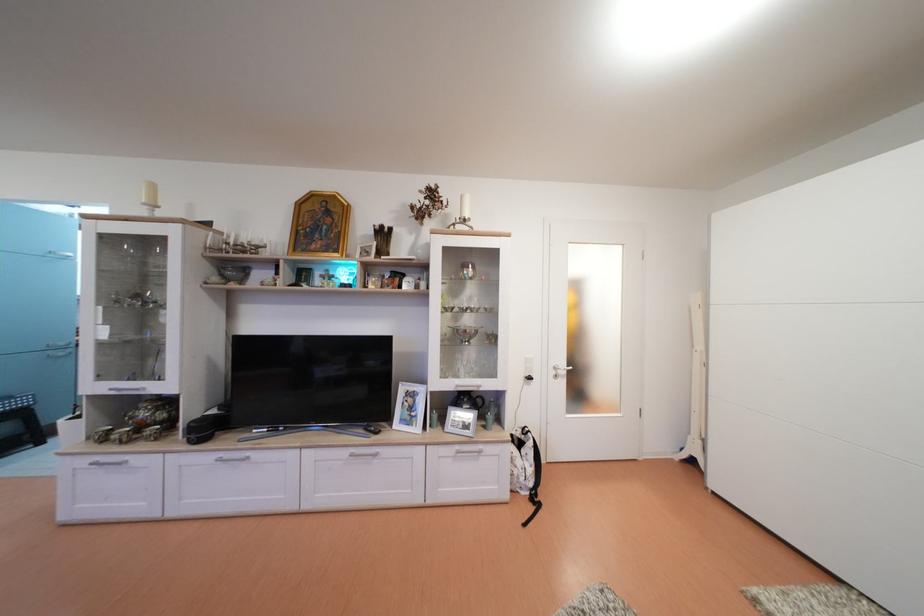
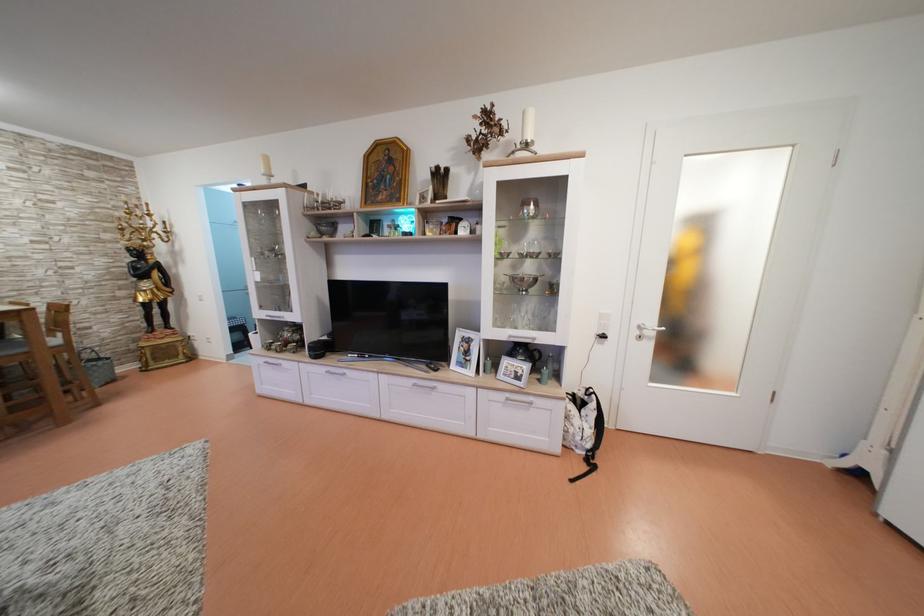
The point at (531,437) is marked in the first image. Where is the corresponding point in the second image?

(596, 398)